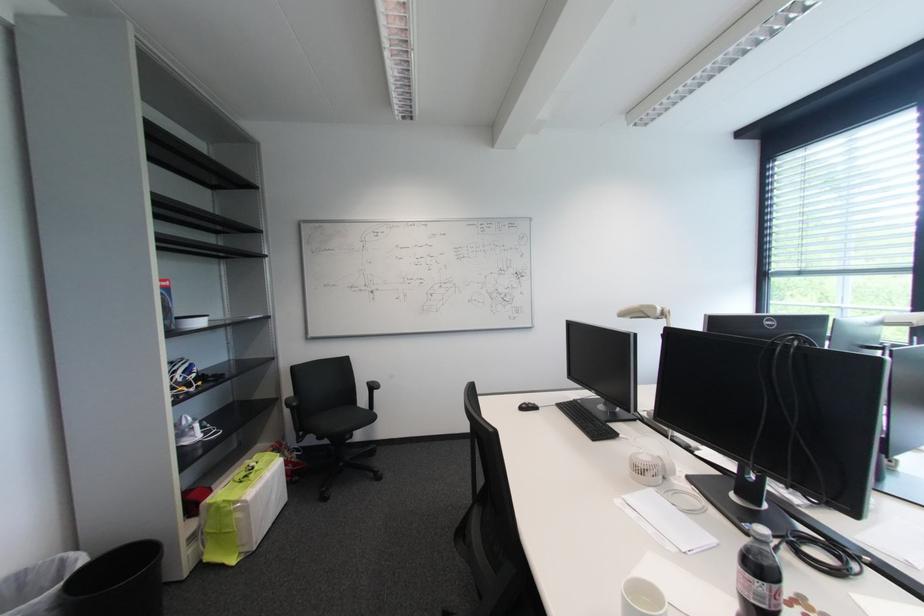
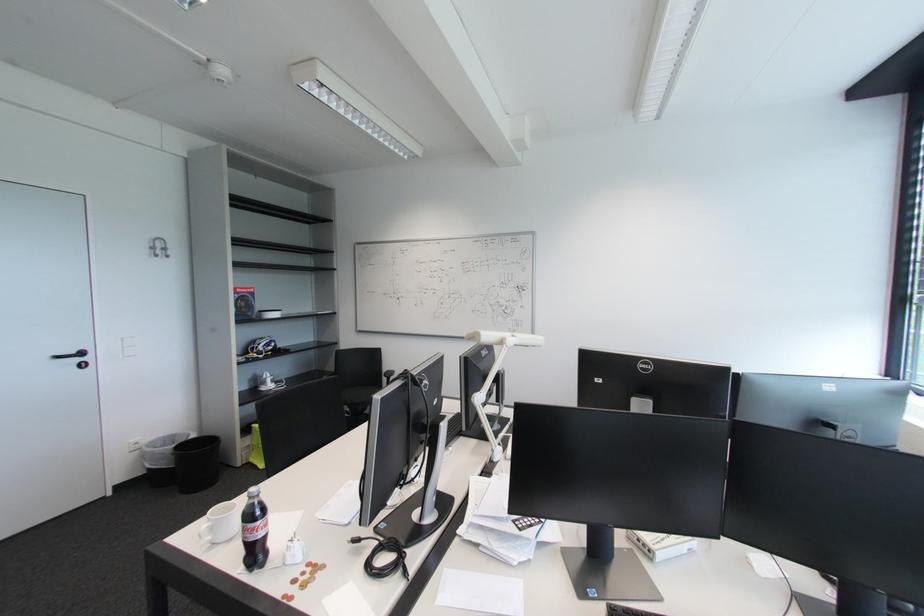
Question: In a continuous first-person perspective shot, in which direction is the camera moving?

Choices:
 (A) Left
 (B) Right
 (C) Forward
 (D) Backward

Answer: (B)